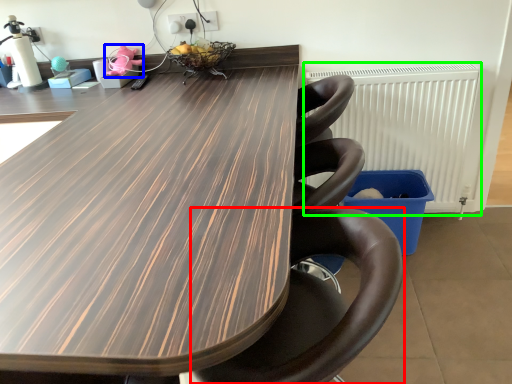
Question: Which object is positioned closest to chair (highlighted by a red box)? Select from toy (highlighted by a blue box) and radiator (highlighted by a green box).

Choices:
 (A) toy
 (B) radiator

Answer: (B)